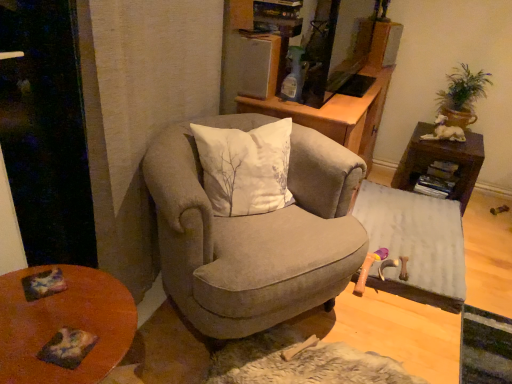
Question: Should I look upward or downward to see wooden table at lower left?

Choices:
 (A) up
 (B) down

Answer: (B)

Question: Is wooden table at lower left located within suede armchair at center?

Choices:
 (A) no
 (B) yes

Answer: (A)

Question: Does suede armchair at center have a greater height compared to wooden table at lower left?

Choices:
 (A) yes
 (B) no

Answer: (A)

Question: Is suede armchair at center positioned behind wooden table at lower left?

Choices:
 (A) no
 (B) yes

Answer: (B)

Question: From a real-world perspective, is suede armchair at center under wooden table at lower left?

Choices:
 (A) yes
 (B) no

Answer: (B)

Question: Can you confirm if suede armchair at center is wider than wooden table at lower left?

Choices:
 (A) no
 (B) yes

Answer: (B)

Question: From the image's perspective, would you say suede armchair at center is positioned over wooden table at lower left?

Choices:
 (A) yes
 (B) no

Answer: (A)

Question: Considering the relative positions of brown wooden table at right, which appears as the first table when viewed from the top, and wooden cabinet at center in the image provided, is brown wooden table at right, which appears as the first table when viewed from the top, to the left of wooden cabinet at center from the viewer's perspective?

Choices:
 (A) yes
 (B) no

Answer: (B)

Question: Is brown wooden table at right, which appears as the first table when viewed from the top, at the right side of wooden cabinet at center?

Choices:
 (A) no
 (B) yes

Answer: (B)

Question: Is brown wooden table at right, marked as the second table in a bottom-to-top arrangement, positioned with its back to wooden cabinet at center?

Choices:
 (A) no
 (B) yes

Answer: (A)

Question: From a real-world perspective, is brown wooden table at right, marked as the second table in a bottom-to-top arrangement, over wooden cabinet at center?

Choices:
 (A) no
 (B) yes

Answer: (A)

Question: Considering the relative sizes of brown wooden table at right, marked as the second table in a bottom-to-top arrangement, and wooden cabinet at center in the image provided, is brown wooden table at right, marked as the second table in a bottom-to-top arrangement, shorter than wooden cabinet at center?

Choices:
 (A) yes
 (B) no

Answer: (A)

Question: Can you confirm if brown wooden table at right, which appears as the first table when viewed from the top, is thinner than wooden cabinet at center?

Choices:
 (A) yes
 (B) no

Answer: (A)

Question: Considering the relative sizes of wooden table at lower left and green leafy plant at upper right in the image provided, is wooden table at lower left shorter than green leafy plant at upper right?

Choices:
 (A) no
 (B) yes

Answer: (A)